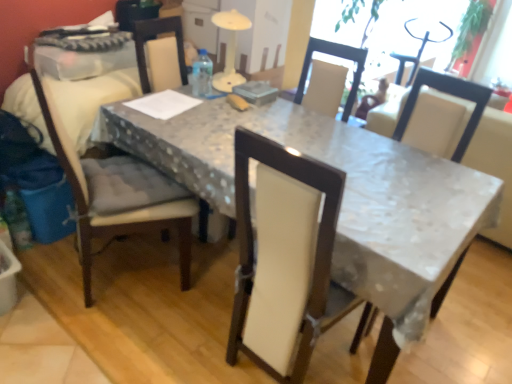
Question: Does white fabric chair at center, the 2th chair when ordered from left to right, contain matte beige cushioned chair at left, the 2th chair when ordered from right to left?

Choices:
 (A) yes
 (B) no

Answer: (B)

Question: Can you confirm if white fabric chair at center, positioned as the 1th chair in right-to-left order, is shorter than matte beige cushioned chair at left, which is the first chair from left to right?

Choices:
 (A) no
 (B) yes

Answer: (B)

Question: Does white fabric chair at center, the 2th chair when ordered from left to right, have a smaller size compared to matte beige cushioned chair at left, which is the first chair from left to right?

Choices:
 (A) yes
 (B) no

Answer: (A)

Question: Is white fabric chair at center, the 2th chair when ordered from left to right, further to the viewer compared to matte beige cushioned chair at left, the 2th chair when ordered from right to left?

Choices:
 (A) yes
 (B) no

Answer: (A)

Question: From the image's perspective, does white fabric chair at center, the 2th chair when ordered from left to right, appear higher than matte beige cushioned chair at left, which is the first chair from left to right?

Choices:
 (A) no
 (B) yes

Answer: (A)

Question: From a real-world perspective, is white fabric chair at center, positioned as the 1th chair in right-to-left order, positioned over matte beige cushioned chair at left, which is the first chair from left to right, based on gravity?

Choices:
 (A) yes
 (B) no

Answer: (A)

Question: Is green leafy plant at upper right at the left side of white fabric chair at center, positioned as the 1th chair in right-to-left order?

Choices:
 (A) yes
 (B) no

Answer: (B)

Question: Is white fabric chair at center, the 2th chair when ordered from left to right, located within green leafy plant at upper right?

Choices:
 (A) no
 (B) yes

Answer: (A)

Question: Is green leafy plant at upper right aimed at white fabric chair at center, positioned as the 1th chair in right-to-left order?

Choices:
 (A) yes
 (B) no

Answer: (B)

Question: Is the depth of green leafy plant at upper right less than that of white fabric chair at center, the 2th chair when ordered from left to right?

Choices:
 (A) no
 (B) yes

Answer: (A)

Question: Does green leafy plant at upper right have a lesser height compared to white fabric chair at center, positioned as the 1th chair in right-to-left order?

Choices:
 (A) yes
 (B) no

Answer: (A)

Question: Is green leafy plant at upper right not close to white fabric chair at center, positioned as the 1th chair in right-to-left order?

Choices:
 (A) no
 (B) yes

Answer: (B)

Question: Is white glossy table at center wider than matte beige cushioned chair at left, the 2th chair when ordered from right to left?

Choices:
 (A) yes
 (B) no

Answer: (A)